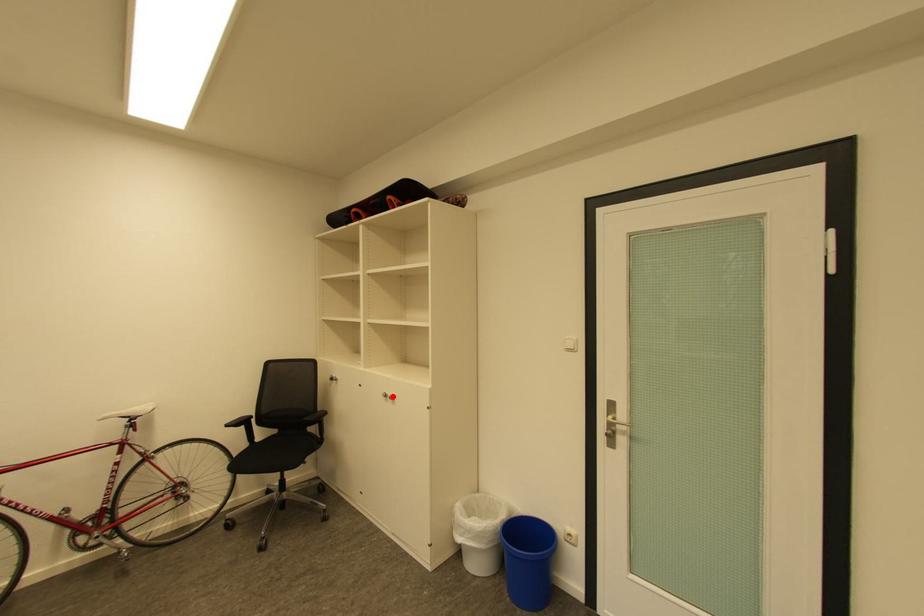
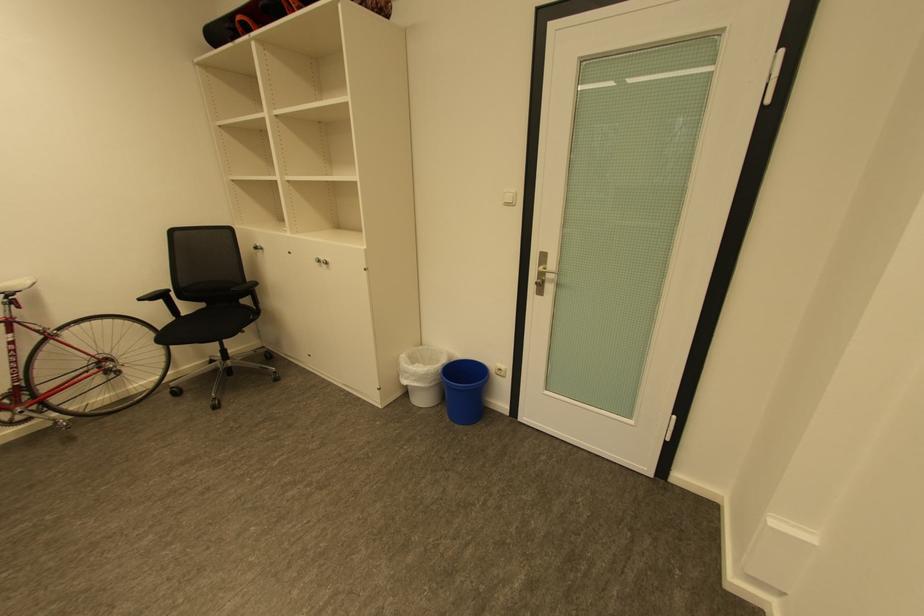
Find the pixel in the second image that matches the highlighted location in the first image.

(325, 262)